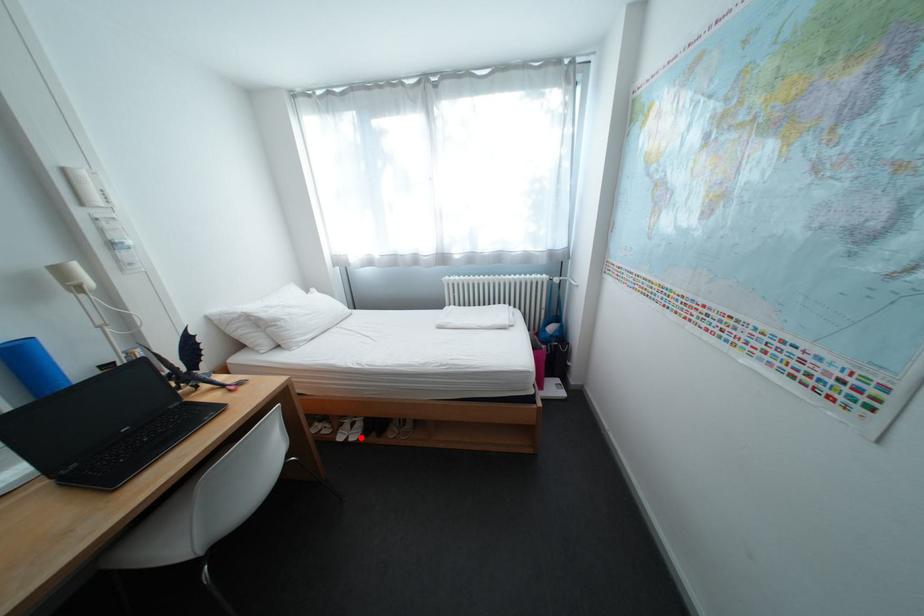
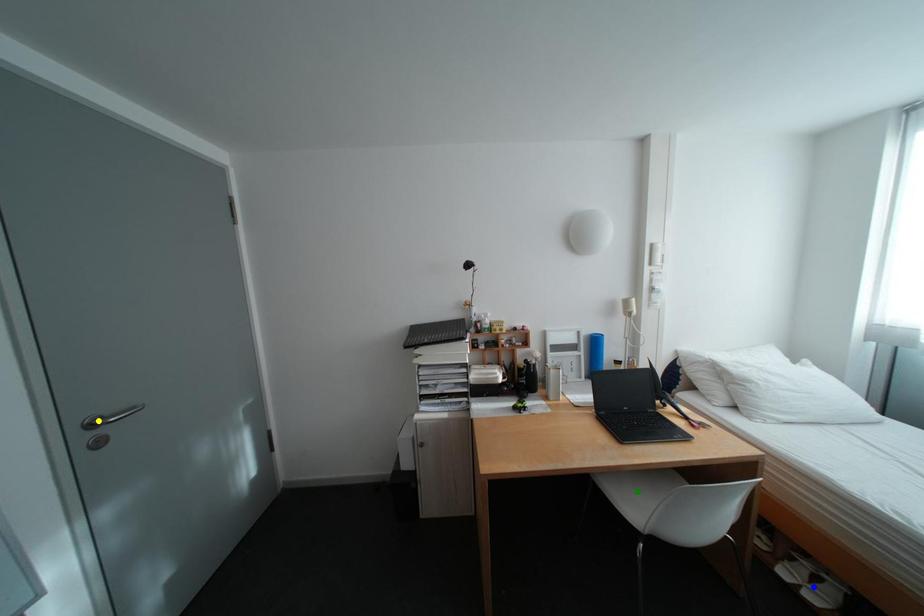
Question: I am providing you with two images of the same scene from different viewpoints. A red point is marked on the first image. You are given multiple points on the second image. Which spot in image 2 lines up with the point in image 1?

Choices:
 (A) green point
 (B) yellow point
 (C) blue point

Answer: (C)